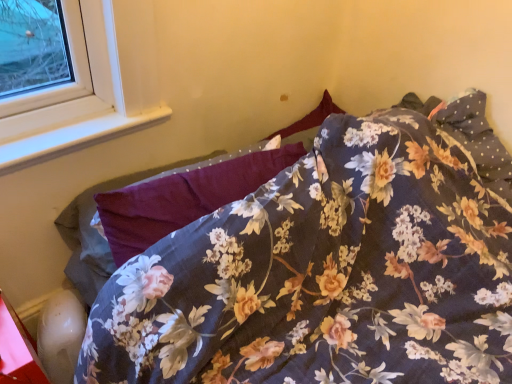
Image resolution: width=512 pixels, height=384 pixels. What are the coordinates of `free space above white plastic window sill at upper left (from a real-world perspective)` in the screenshot? It's located at (73, 124).